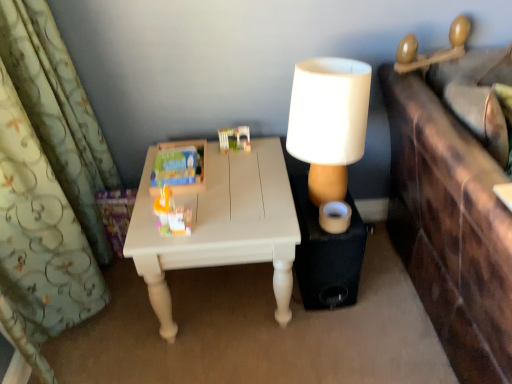
Question: From a real-world perspective, relative to green floral fabric curtain at left, is black matte speaker at lower right vertically above or below?

Choices:
 (A) above
 (B) below

Answer: (B)

Question: Is black matte speaker at lower right wider or thinner than green floral fabric curtain at left?

Choices:
 (A) thin
 (B) wide

Answer: (B)

Question: Estimate the real-world distances between objects in this image. Which object is closer to the translucent plastic toy at center, which is the 2th toy in right-to-left order?

Choices:
 (A) green floral fabric curtain at left
 (B) brown leather vanity at right
 (C) black matte speaker at lower right
 (D) matte plastic toy at center, positioned as the 1th toy in left-to-right order
 (E) white painted wood table at center

Answer: (D)

Question: Based on their relative distances, which object is farther from the white painted wood table at center?

Choices:
 (A) brown leather vanity at right
 (B) translucent plastic toy at center, which is the 2th toy in right-to-left order
 (C) matte plastic toy at center, which is the 3th toy in right-to-left order
 (D) black matte speaker at lower right
 (E) plastic building blocks at center, which is counted as the 3th toy, starting from the left

Answer: (A)